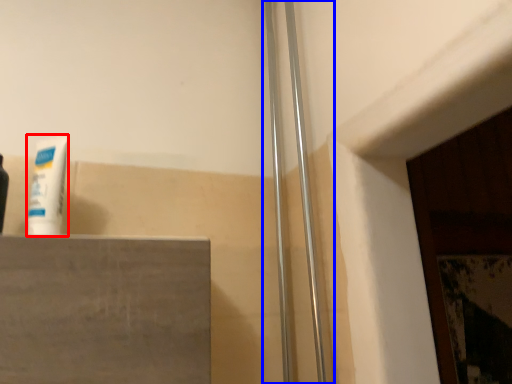
Question: Among these objects, which one is nearest to the camera, toothpaste (highlighted by a red box) or shower door (highlighted by a blue box)?

Choices:
 (A) toothpaste
 (B) shower door

Answer: (A)